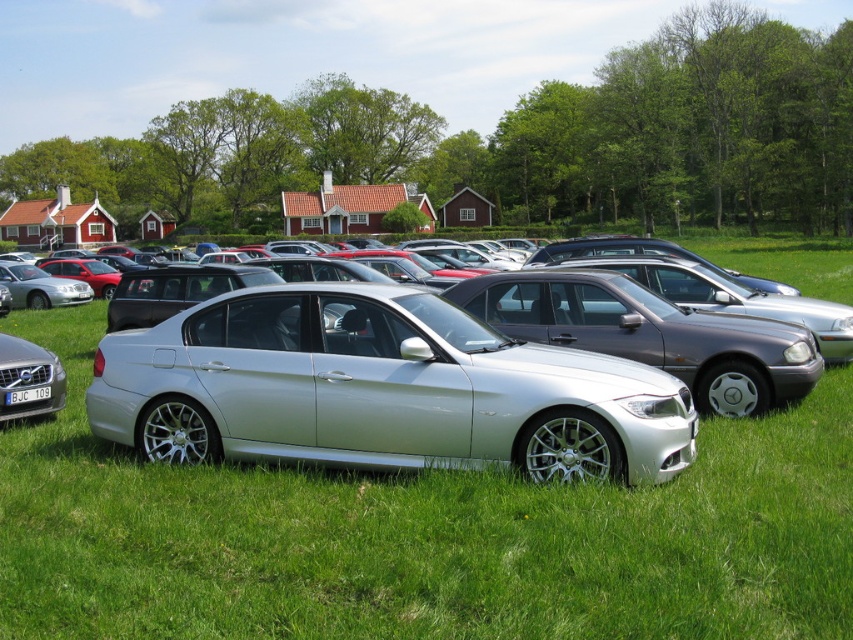
You are a parking attendant trying to fit a new car into the space between the silver metallic car at center and the silver metallic sedan at center. Based on their widths, can you determine if there is enough space for the new car?

The silver metallic car at center might be wider than silver metallic sedan at center, so there may not be enough space for the new car between them.

You are a photographer trying to capture both the silver metallic car at center and the silver metallic volvo at lower left in a single frame. Based on their positions, which car is closer to the top edge of your camera view?

The silver metallic car at center is above the silver metallic volvo at lower left, so it is closer to the top edge of the camera view.